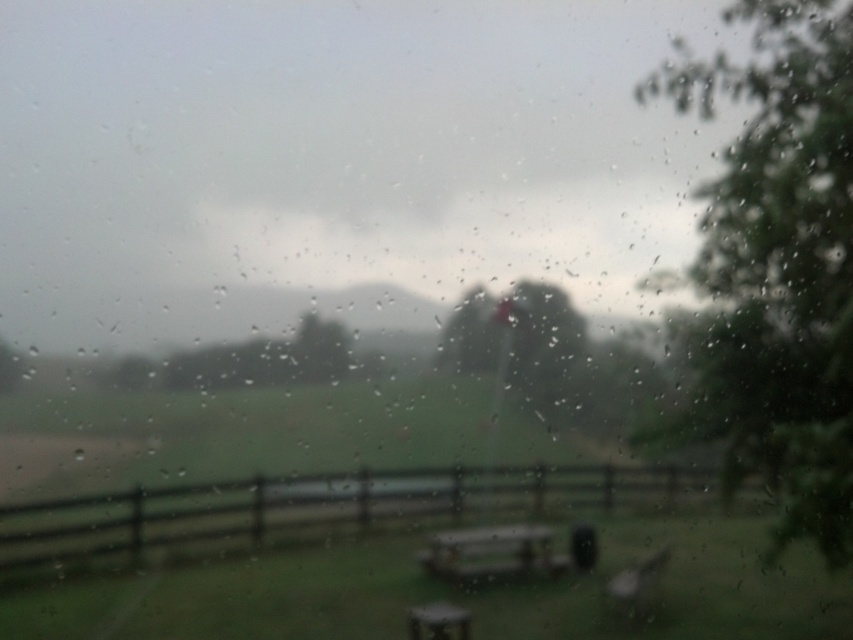
You are planning to take a photo of the wooden picnic table at center and the green leafy tree at right from a distance. Which object will appear wider in the photo?

The green leafy tree at right will appear wider in the photo because its width surpasses that of the wooden picnic table at center.